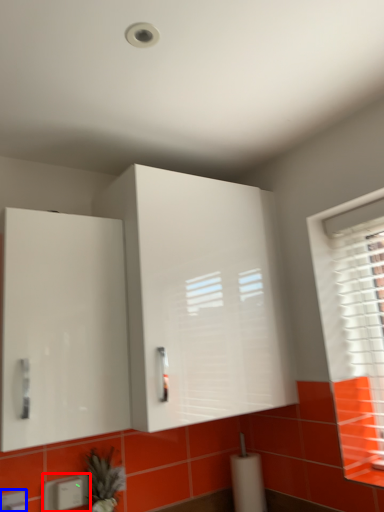
Question: Which object appears closest to the camera in this image, electric outlet (highlighted by a red box) or electric outlet (highlighted by a blue box)?

Choices:
 (A) electric outlet
 (B) electric outlet

Answer: (B)